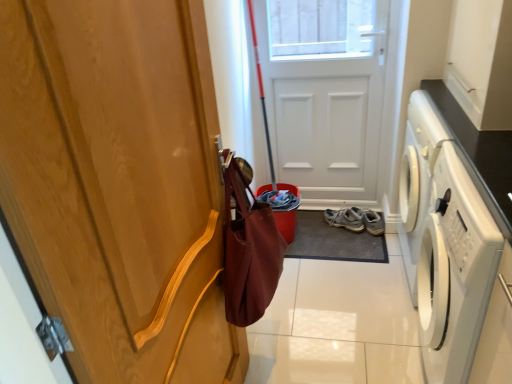
Where is `vacant space in front of dark gray rubber doormat at center`? This screenshot has width=512, height=384. vacant space in front of dark gray rubber doormat at center is located at coordinates click(x=351, y=290).